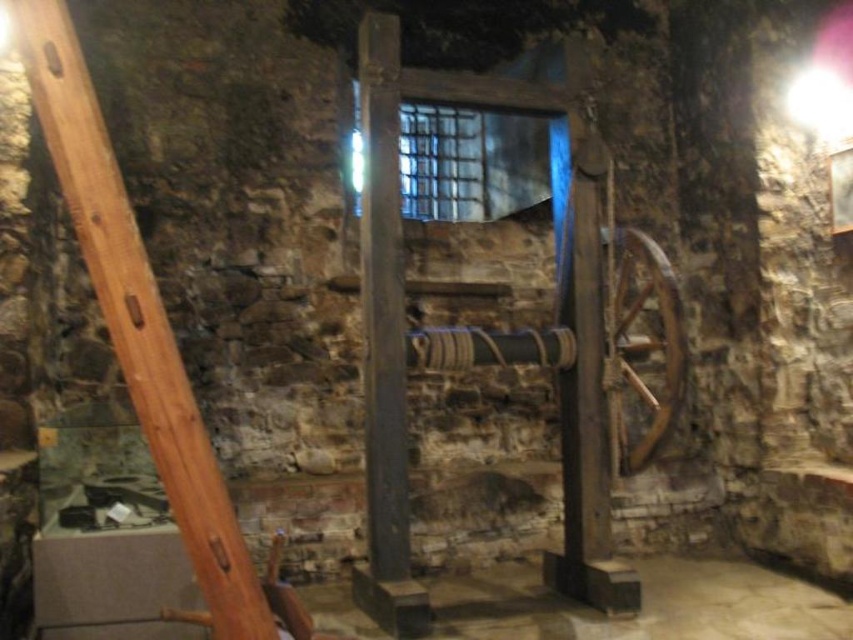
Can you confirm if smooth wooden pole at left is shorter than smooth dark wood pillar at center?

Yes, smooth wooden pole at left is shorter than smooth dark wood pillar at center.

Does point (70, 38) come farther from viewer compared to point (386, 204)?

No.

Is point (67, 77) positioned behind point (387, 380)?

No, (67, 77) is closer to viewer.

Identify the location of smooth wooden pole at left. The image size is (853, 640). (137, 317).